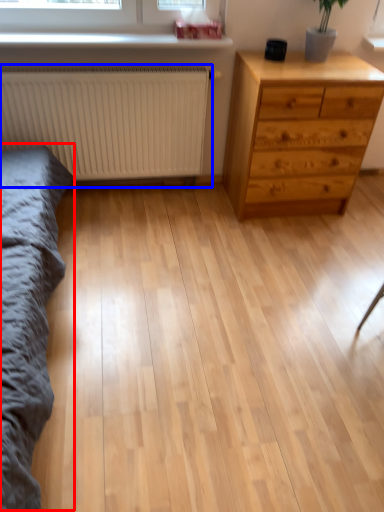
Question: Which object is closer to the camera taking this photo, bed frame (highlighted by a red box) or radiator (highlighted by a blue box)?

Choices:
 (A) bed frame
 (B) radiator

Answer: (A)